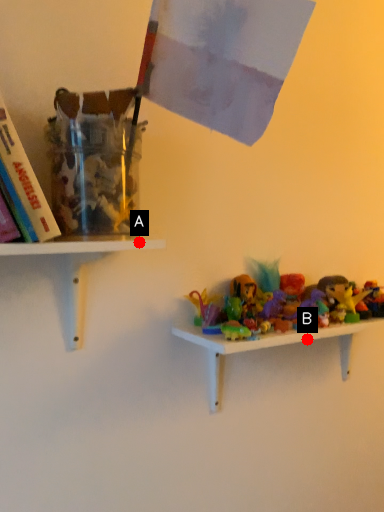
Question: Two points are circled on the image, labeled by A and B beside each circle. Which point is closer to the camera taking this photo?

Choices:
 (A) A is closer
 (B) B is closer

Answer: (A)